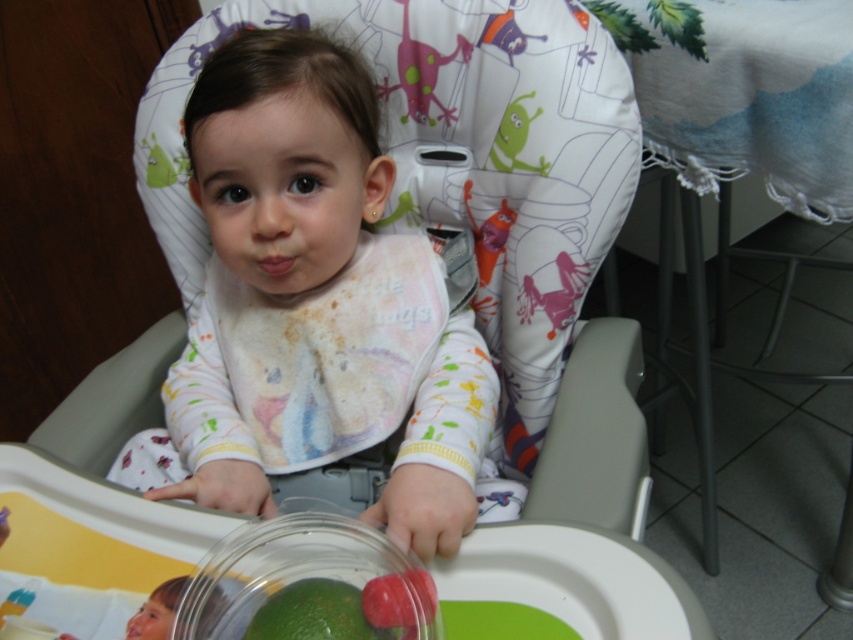
You are a parent trying to place a spoon on the tray of the high chair. The spoon is currently at point A, which is at coordinates 0.8, 0.4. Can you move the spoon to the transparent glass bowl at lower center without moving it past the edge of the tray?

The transparent glass bowl at lower center is located at point (306, 584). The spoon is at (340, 512). Since the coordinates are within the tray area, yes, you can move the spoon to the transparent glass bowl at lower center without moving it past the edge of the tray.

You are a parent trying to give your child a snack. You have a green matte lime at lower center and a green rubber toy at upper right on the tray. Which item is more suitable for the child to hold safely?

The green matte lime at lower center is smaller than the green rubber toy at upper right, so the green rubber toy at upper right is larger and may be easier for the child to hold safely.